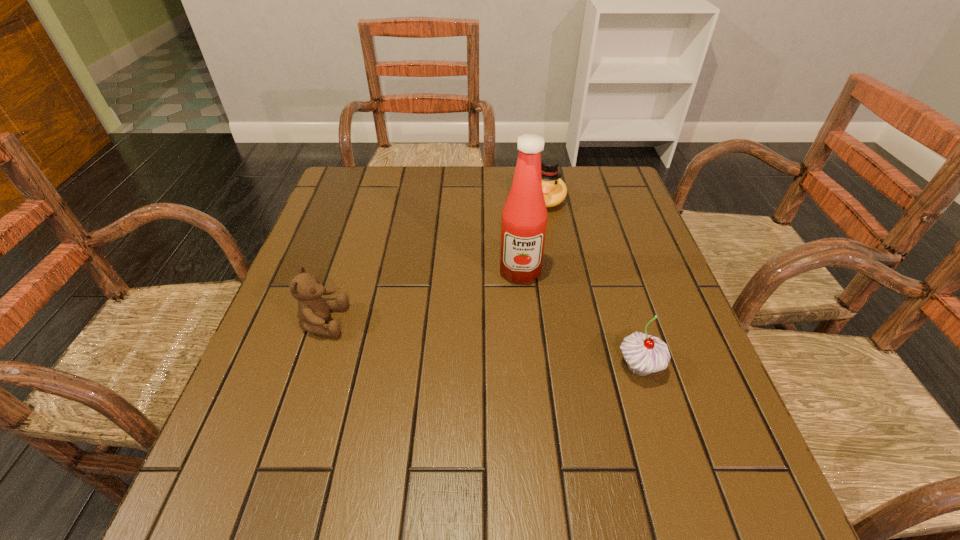
This screenshot has width=960, height=540. Find the location of `vacant space positioned on the front-facing side of the duck`. vacant space positioned on the front-facing side of the duck is located at coordinates (536, 236).

Locate an element on the screen. The height and width of the screenshot is (540, 960). free space located 0.280m on the front-facing side of the duck is located at coordinates (518, 281).

What are the coordinates of `free location located 0.360m on the front-facing side of the condiment` in the screenshot? It's located at (519, 430).

The width and height of the screenshot is (960, 540). In order to click on free space located 0.110m on the front-facing side of the condiment in this screenshot , I will do `click(520, 322)`.

Identify the location of vacant space located 0.290m on the front-facing side of the condiment. Image resolution: width=960 pixels, height=540 pixels. (519, 395).

Identify the location of object present at the far edge. The width and height of the screenshot is (960, 540). (554, 189).

Locate an element on the screen. object at the left edge is located at coordinates (313, 310).

I want to click on object positioned at the right edge, so click(644, 354).

Where is `vacant space at the far edge of the desktop`? vacant space at the far edge of the desktop is located at coordinates (497, 175).

You are a GUI agent. You are given a task and a screenshot of the screen. Output one action in this format:
    pyautogui.click(x=<x>, y=<y>)
    Task: Click on the free space at the near edge of the desktop
    
    Given the screenshot: What is the action you would take?
    pyautogui.click(x=630, y=434)